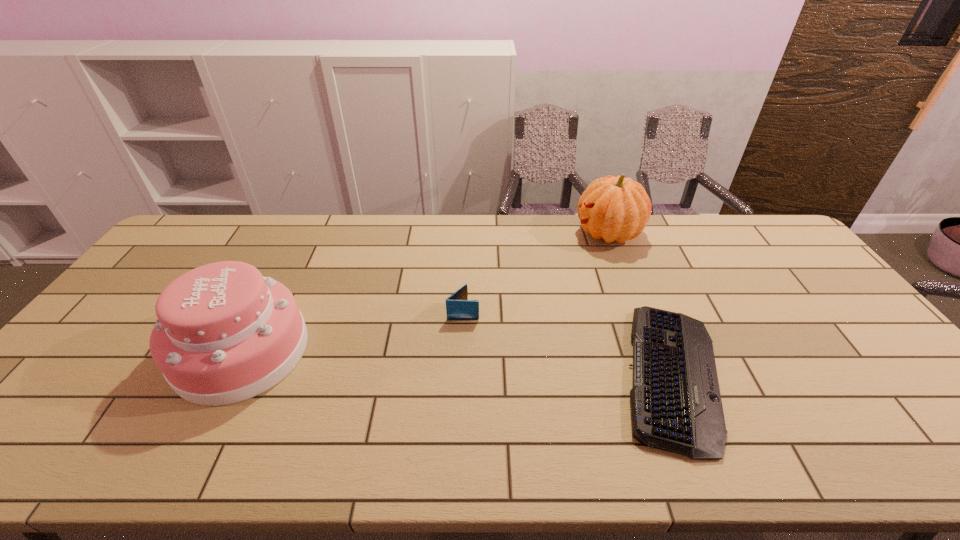
I want to click on free space located 0.210m on the back of the shortest object, so point(627,265).

You are a GUI agent. You are given a task and a screenshot of the screen. Output one action in this format:
    pyautogui.click(x=<x>, y=<y>)
    Task: Click on the object that is at the far edge
    
    Given the screenshot: What is the action you would take?
    pyautogui.click(x=617, y=209)

I want to click on object at the near edge, so click(x=676, y=406).

Locate an element on the screen. blank space at the far edge of the desktop is located at coordinates (575, 239).

The image size is (960, 540). In order to click on free location at the near edge in this screenshot , I will do `click(533, 447)`.

In the image, there is a desktop. Identify the location of vacant space at the left edge. (182, 260).

Where is `vacant area at the right edge of the desktop`? vacant area at the right edge of the desktop is located at coordinates (880, 374).

Find the location of a particular element. vacant region at the far left corner of the desktop is located at coordinates (195, 246).

The height and width of the screenshot is (540, 960). What are the coordinates of `free space between the third tallest object and the computer keyboard` in the screenshot? It's located at (566, 343).

The width and height of the screenshot is (960, 540). I want to click on free space between the farthest object and the birthday cake, so click(425, 292).